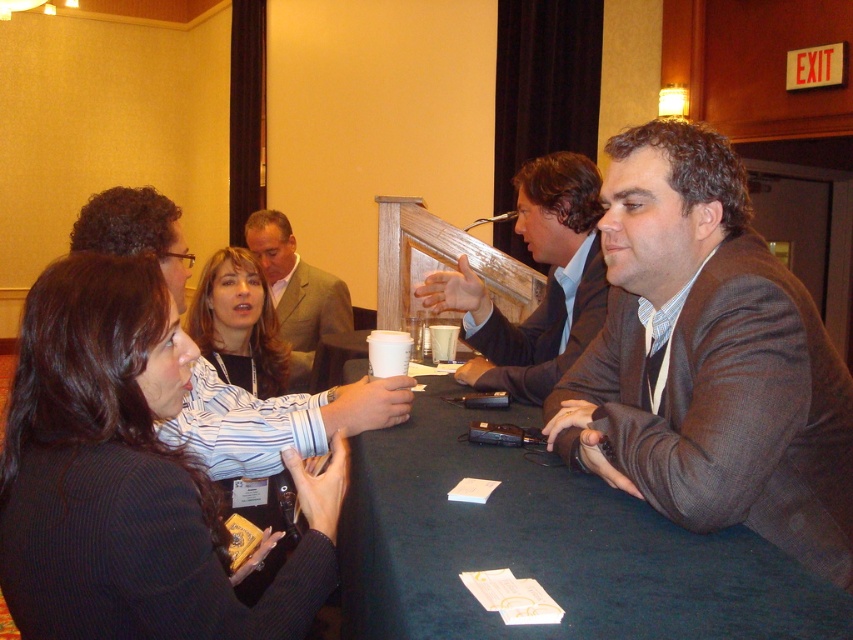
You are organizing a small meeting and need to place a new name tag on the table. Given the dark blue fabric table at center and the light brown textured suit at center, which object is more suitable to place the name tag on?

The dark blue fabric table at center is larger in size than the light brown textured suit at center, so the name tag should be placed on the dark blue fabric table at center.

You are a photographer positioned at the back of the conference room. You need to take a photo of the light brown textured suit at center and the dark blue fabric table at center. Which object will appear closer to the bottom of the photo?

The dark blue fabric table at center will appear closer to the bottom of the photo because it is positioned below the light brown textured suit at center in the image.